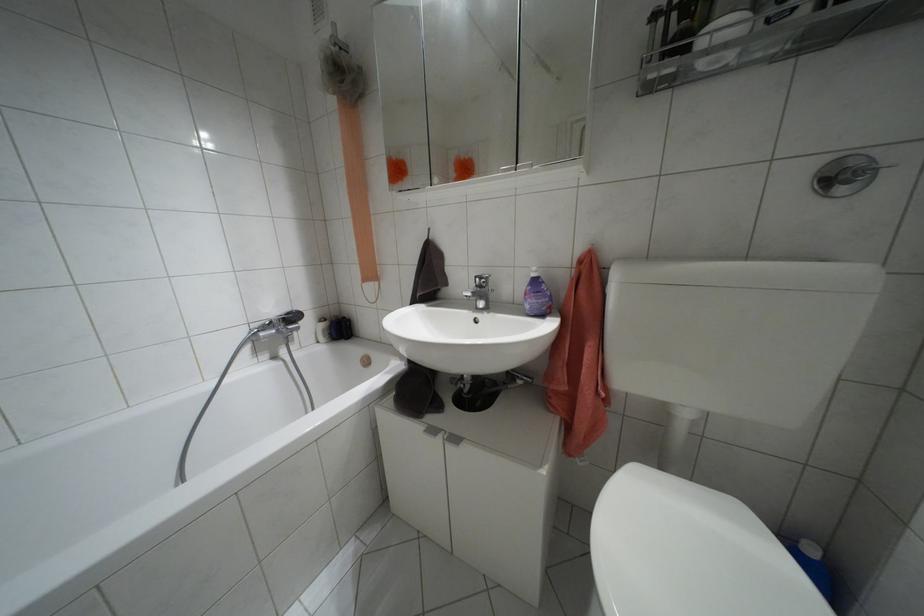
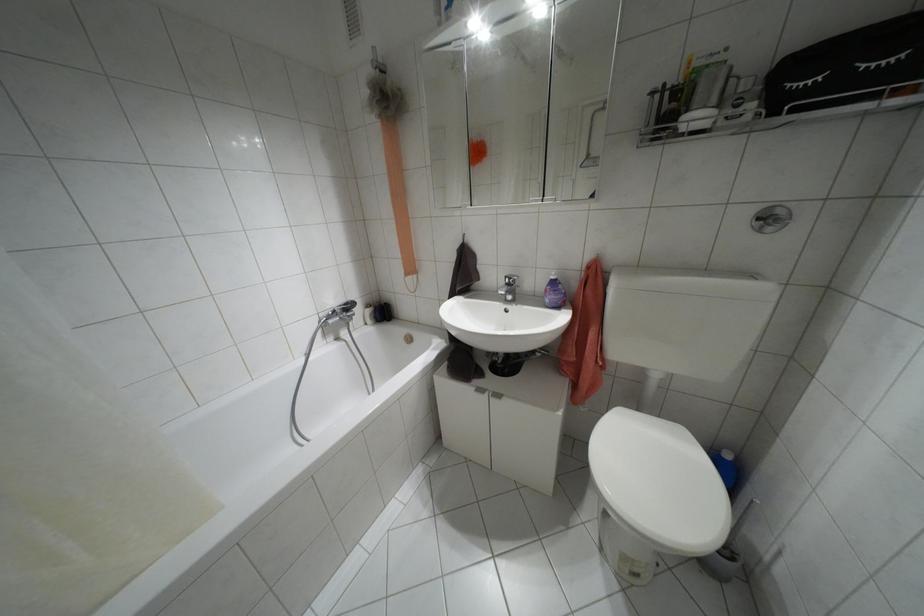
Where in the second image is the point corresponding to pixel 671 549 from the first image?

(643, 466)